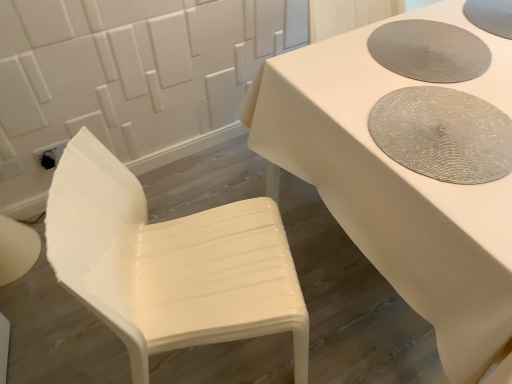
Question: From a real-world perspective, relative to gray woven placemat at upper right, marked as the first manhole cover in a top-to-bottom arrangement, is textured gray placemat at upper right, the second manhole cover positioned from the bottom, vertically above or below?

Choices:
 (A) below
 (B) above

Answer: (A)

Question: Considering the relative positions of textured gray placemat at upper right, the second manhole cover positioned from the bottom, and gray woven placemat at upper right, marked as the first manhole cover in a top-to-bottom arrangement, in the image provided, is textured gray placemat at upper right, the second manhole cover positioned from the bottom, to the left or to the right of gray woven placemat at upper right, marked as the first manhole cover in a top-to-bottom arrangement,?

Choices:
 (A) left
 (B) right

Answer: (A)

Question: Estimate the real-world distances between objects in this image. Which object is farther from the gray woven placemat at upper right, marked as the first manhole cover in a top-to-bottom arrangement?

Choices:
 (A) textured gray placemat at upper right, the second manhole cover positioned from the bottom
 (B) white glossy chair at left
 (C) white glossy table at center
 (D) textured gray mat at upper right, which appears as the 1th manhole cover when ordered from the bottom

Answer: (B)

Question: Estimate the real-world distances between objects in this image. Which object is closer to the textured gray placemat at upper right, which ranks as the second manhole cover in top-to-bottom order?

Choices:
 (A) white glossy table at center
 (B) gray woven placemat at upper right, positioned as the 3th manhole cover in bottom-to-top order
 (C) white glossy chair at left
 (D) textured gray mat at upper right, which appears as the 1th manhole cover when ordered from the bottom

Answer: (A)